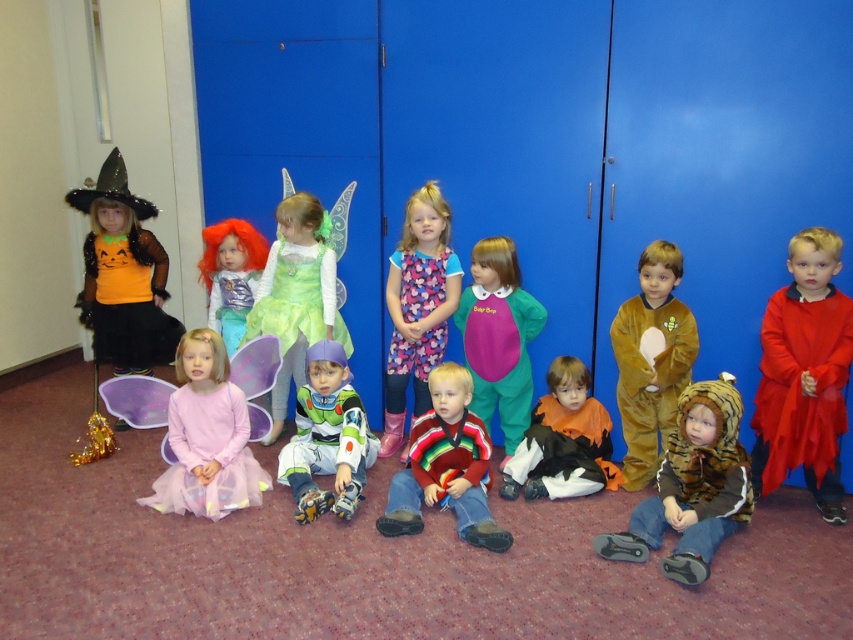
Who is higher up, shiny silver helmet at center or fluffy pink dress at center?

fluffy pink dress at center

Can you confirm if shiny silver helmet at center is wider than fluffy pink dress at center?

Yes.

Who is more distant from viewer, (318, 348) or (421, 310)?

Point (421, 310)

The height and width of the screenshot is (640, 853). In order to click on shiny silver helmet at center in this screenshot , I will do `click(328, 436)`.

Is pink tulle dress at center taller than shiny orange wig at center?

Yes.

Does point (202, 403) come in front of point (241, 317)?

That is True.

Is point (167, 403) more distant than point (200, 259)?

No.

What are the coordinates of `pink tulle dress at center` in the screenshot? It's located at (207, 436).

Does point (316, 300) come farther from viewer compared to point (511, 250)?

Yes, point (316, 300) is behind point (511, 250).

In the scene shown: Who is more distant from viewer, (311, 228) or (521, 344)?

The point (311, 228) is more distant.

Is point (321, 321) more distant than point (497, 321)?

Yes, point (321, 321) is farther from viewer.

This screenshot has width=853, height=640. Find the location of `green satin dress at center`. green satin dress at center is located at coordinates (296, 296).